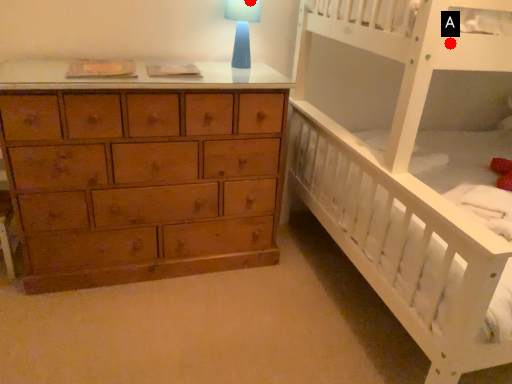
Question: Two points are circled on the image, labeled by A and B beside each circle. Among these points, which one is farthest from the camera?

Choices:
 (A) A is further
 (B) B is further

Answer: (B)